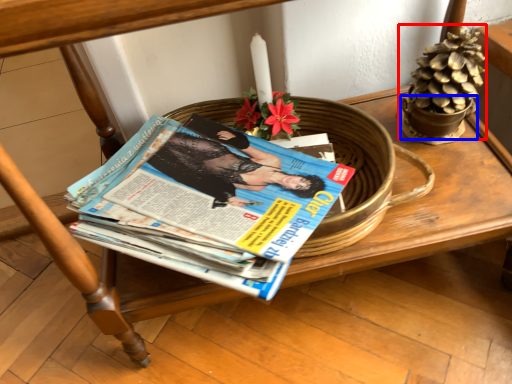
Question: Which of the following is the farthest to the observer, flower basket (highlighted by a red box) or flowerpot (highlighted by a blue box)?

Choices:
 (A) flower basket
 (B) flowerpot

Answer: (B)